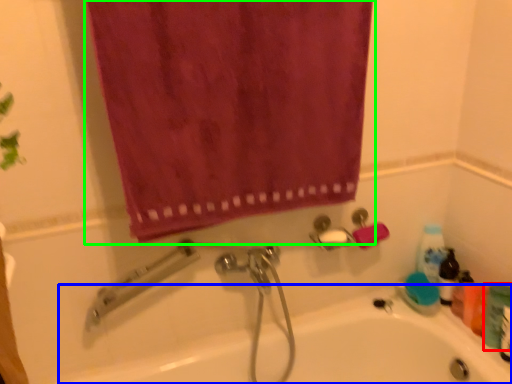
Question: Which is farther away from toiletry (highlighted by a red box)? bath (highlighted by a blue box) or curtain (highlighted by a green box)?

Choices:
 (A) bath
 (B) curtain

Answer: (B)